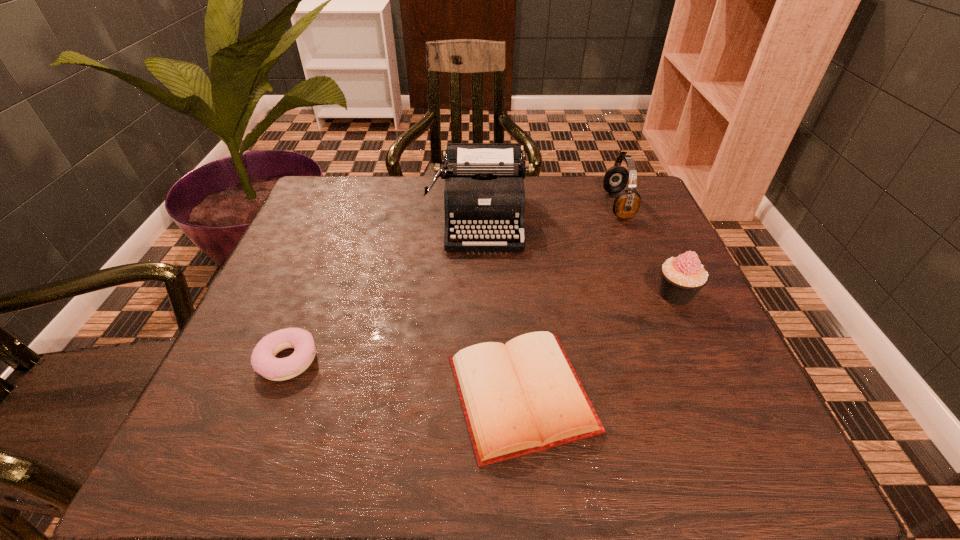
The width and height of the screenshot is (960, 540). I want to click on typewriter, so click(x=484, y=193).

Image resolution: width=960 pixels, height=540 pixels. What are the coordinates of `headset` in the screenshot? It's located at (627, 203).

Where is `the third farthest object`? The image size is (960, 540). the third farthest object is located at coordinates (682, 277).

Image resolution: width=960 pixels, height=540 pixels. Identify the location of cupcake. (682, 277).

This screenshot has width=960, height=540. What are the coordinates of `the leftmost object` in the screenshot? It's located at (263, 360).

Where is `the second shortest object`? the second shortest object is located at coordinates (263, 360).

Find the location of a particular element. The height and width of the screenshot is (540, 960). the shortest object is located at coordinates (522, 397).

At what (x,y) coordinates should I click in order to perform the action: click on blank area located 0.150m on the typing side of the typewriter. Please return your answer as a coordinate pair (x, y). This screenshot has width=960, height=540. Looking at the image, I should click on (481, 300).

Image resolution: width=960 pixels, height=540 pixels. I want to click on vacant space situated on the ear cups of the headset, so tap(468, 205).

I want to click on vacant space located 0.130m on the ear cups of the headset, so click(x=557, y=205).